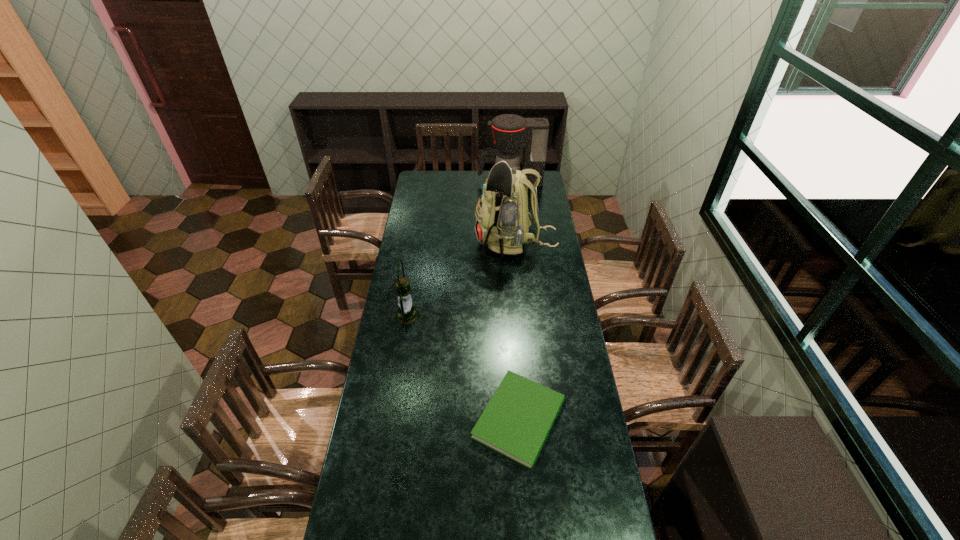
Where is `paperback book located in the right edge section of the desktop`? paperback book located in the right edge section of the desktop is located at coordinates (516, 422).

The height and width of the screenshot is (540, 960). Find the location of `object located at the far right corner`. object located at the far right corner is located at coordinates (510, 132).

This screenshot has width=960, height=540. What are the coordinates of `free location at the left edge` in the screenshot? It's located at (430, 232).

Identify the location of free space at the right edge. The width and height of the screenshot is (960, 540). (565, 309).

You are a GUI agent. You are given a task and a screenshot of the screen. Output one action in this format:
    pyautogui.click(x=<x>, y=<y>)
    Task: Click on the free spot at the far left corner of the desktop
    
    Given the screenshot: What is the action you would take?
    pyautogui.click(x=424, y=186)

The image size is (960, 540). What are the coordinates of `free space at the far right corner of the desktop` in the screenshot? It's located at (545, 188).

Image resolution: width=960 pixels, height=540 pixels. Identify the location of unoccupied position between the third nearest object and the shortest object. (517, 331).

You are a GUI agent. You are given a task and a screenshot of the screen. Output one action in this format:
    pyautogui.click(x=<x>, y=<y>)
    Task: Click on the vacant area that lies between the paperback book and the leftmost object
    The height and width of the screenshot is (540, 960).
    Given the screenshot: What is the action you would take?
    pyautogui.click(x=463, y=367)

This screenshot has width=960, height=540. Identify the location of vacant area between the backpack and the second shortest object. (462, 280).

Find the location of a particular element. Image resolution: width=960 pixels, height=540 pixels. vacant area that lies between the leftmost object and the tallest object is located at coordinates (462, 280).